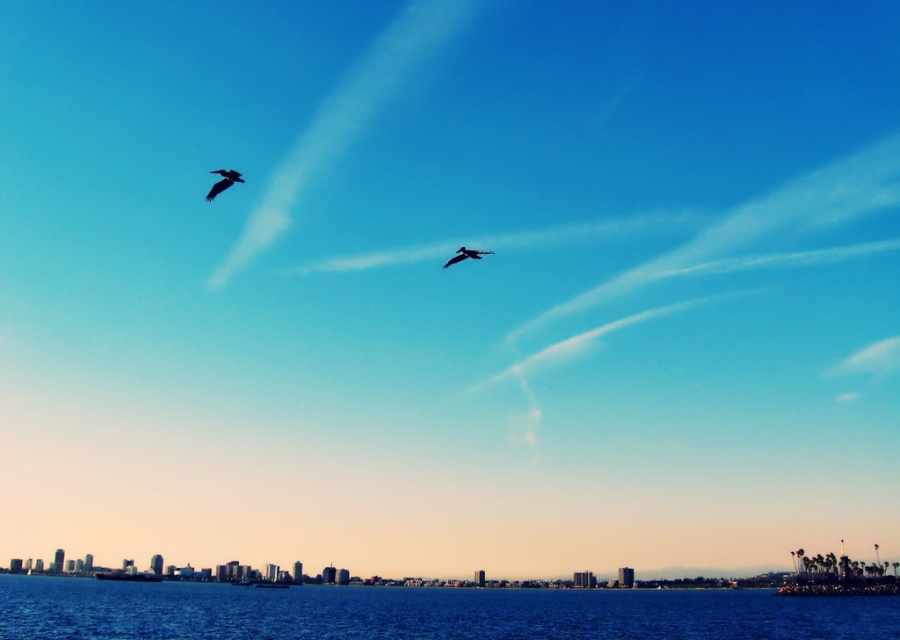
Question: Which object appears closest to the camera in this image?

Choices:
 (A) silvery metallic bird at center
 (B) blue water at lower center
 (C) silhouette feathered bird at upper left

Answer: (C)

Question: Which of these objects is positioned farthest from the blue water at lower center?

Choices:
 (A) silhouette feathered bird at upper left
 (B) silvery metallic bird at center

Answer: (A)

Question: Does blue water at lower center have a greater width compared to silvery metallic bird at center?

Choices:
 (A) no
 (B) yes

Answer: (B)

Question: Which point appears closest to the camera in this image?

Choices:
 (A) (221, 188)
 (B) (243, 604)

Answer: (A)

Question: Does blue water at lower center appear over silvery metallic bird at center?

Choices:
 (A) no
 (B) yes

Answer: (A)

Question: Can you confirm if silhouette feathered bird at upper left is bigger than silvery metallic bird at center?

Choices:
 (A) no
 (B) yes

Answer: (B)